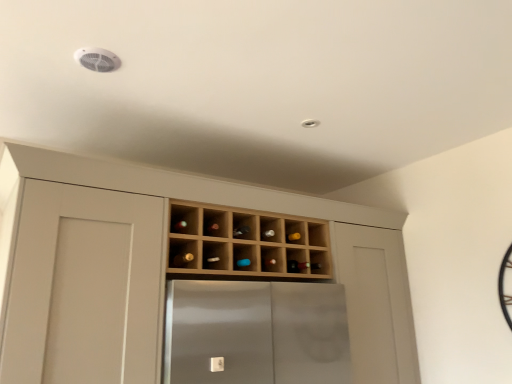
Find the location of a particular element. The image size is (512, 384). matte brown wine bottle at center, the first wine bottle positioned from the left is located at coordinates (182, 259).

The height and width of the screenshot is (384, 512). What do you see at coordinates (182, 259) in the screenshot?
I see `matte brown wine bottle at center, the second wine bottle when ordered from back to front` at bounding box center [182, 259].

The height and width of the screenshot is (384, 512). What are the coordinates of `light wood wine rack at center` in the screenshot? It's located at [x=234, y=206].

I want to click on matte brown wine bottle at center, the second wine bottle when ordered from bottom to top, so click(182, 259).

Which object is wider, translucent glass wine bottle at center, the 1th wine bottle positioned from the right, or matte brown wine bottle at center, the first wine bottle positioned from the left?

With larger width is matte brown wine bottle at center, the first wine bottle positioned from the left.

In terms of height, does translucent glass wine bottle at center, the 2th wine bottle in the front-to-back sequence, look taller or shorter compared to matte brown wine bottle at center, the second wine bottle when ordered from back to front?

translucent glass wine bottle at center, the 2th wine bottle in the front-to-back sequence, is shorter than matte brown wine bottle at center, the second wine bottle when ordered from back to front.

Which is more to the right, translucent glass wine bottle at center, marked as the first wine bottle in a back-to-front arrangement, or matte brown wine bottle at center, placed as the 1th wine bottle when sorted from front to back?

translucent glass wine bottle at center, marked as the first wine bottle in a back-to-front arrangement.

Is translucent glass wine bottle at center, the 1th wine bottle ordered from the bottom, directly adjacent to matte brown wine bottle at center, positioned as the 2th wine bottle in right-to-left order?

No, translucent glass wine bottle at center, the 1th wine bottle ordered from the bottom, is not next to matte brown wine bottle at center, positioned as the 2th wine bottle in right-to-left order.

From a real-world perspective, is wooden wine rack at center below light wood wine rack at center?

No, from a real-world perspective, wooden wine rack at center is not beneath light wood wine rack at center.

Is point (298, 240) closer or farther from the camera than point (205, 178)?

Point (298, 240) is positioned farther from the camera compared to point (205, 178).

How far apart are wooden wine rack at center and light wood wine rack at center?

wooden wine rack at center and light wood wine rack at center are 8.64 inches apart from each other.

Is wooden wine rack at center behind light wood wine rack at center?

That is True.

Considering the relative sizes of light wood wine rack at center and matte brown wine bottle at center, the second wine bottle when ordered from bottom to top, in the image provided, is light wood wine rack at center taller than matte brown wine bottle at center, the second wine bottle when ordered from bottom to top,?

Yes, light wood wine rack at center is taller than matte brown wine bottle at center, the second wine bottle when ordered from bottom to top.

From the image's perspective, relative to matte brown wine bottle at center, the first wine bottle in the top-to-bottom sequence, is light wood wine rack at center above or below?

light wood wine rack at center is situated lower than matte brown wine bottle at center, the first wine bottle in the top-to-bottom sequence, in the image.

Which is in front, light wood wine rack at center or matte brown wine bottle at center, placed as the 1th wine bottle when sorted from front to back?

light wood wine rack at center is more forward.

Which is correct: light wood wine rack at center is inside matte brown wine bottle at center, the second wine bottle when ordered from bottom to top, or outside of it?

The correct answer is: outside.

Image resolution: width=512 pixels, height=384 pixels. In order to click on cupboard below the wooden wine rack at center (from a real-world perspective) in this screenshot , I will do coord(234,206).

Between light wood wine rack at center and wooden wine rack at center, which one appears on the right side from the viewer's perspective?

From the viewer's perspective, wooden wine rack at center appears more on the right side.

Is light wood wine rack at center closer to the viewer compared to wooden wine rack at center?

Yes, it is in front of wooden wine rack at center.

Which is in front, point (106, 183) or point (255, 250)?

Point (106, 183)

Image resolution: width=512 pixels, height=384 pixels. Identify the location of wine bottle that appears on the right of wooden wine rack at center. (301, 266).

Which of these two, translucent glass wine bottle at center, marked as the first wine bottle in a back-to-front arrangement, or wooden wine rack at center, stands taller?

With more height is wooden wine rack at center.

Does translucent glass wine bottle at center, the 2th wine bottle positioned from the top, have a smaller size compared to wooden wine rack at center?

Yes.

Between point (295, 269) and point (247, 219), which one is positioned in front?

The point (247, 219) is more forward.

Does matte brown wine bottle at center, the second wine bottle when ordered from back to front, have a larger size compared to wooden wine rack at center?

Actually, matte brown wine bottle at center, the second wine bottle when ordered from back to front, might be smaller than wooden wine rack at center.

From a real-world perspective, between matte brown wine bottle at center, the second wine bottle when ordered from bottom to top, and wooden wine rack at center, who is vertically lower?

matte brown wine bottle at center, the second wine bottle when ordered from bottom to top, is physically lower.

Is matte brown wine bottle at center, the first wine bottle in the top-to-bottom sequence, wider than wooden wine rack at center?

Incorrect, the width of matte brown wine bottle at center, the first wine bottle in the top-to-bottom sequence, does not surpass that of wooden wine rack at center.

Who is bigger, matte brown wine bottle at center, the second wine bottle when ordered from bottom to top, or translucent glass wine bottle at center, the 1th wine bottle ordered from the bottom?

matte brown wine bottle at center, the second wine bottle when ordered from bottom to top, is bigger.

Based on the photo, does matte brown wine bottle at center, placed as the 1th wine bottle when sorted from front to back, have a lesser height compared to translucent glass wine bottle at center, the 1th wine bottle positioned from the right?

No.

Is matte brown wine bottle at center, positioned as the 2th wine bottle in right-to-left order, facing away from translucent glass wine bottle at center, the 1th wine bottle ordered from the bottom?

No, matte brown wine bottle at center, positioned as the 2th wine bottle in right-to-left order, is not facing away from translucent glass wine bottle at center, the 1th wine bottle ordered from the bottom.

Considering the relative sizes of matte brown wine bottle at center, the second wine bottle when ordered from bottom to top, and translucent glass wine bottle at center, arranged as the 2th wine bottle when viewed from the left, in the image provided, is matte brown wine bottle at center, the second wine bottle when ordered from bottom to top, wider than translucent glass wine bottle at center, arranged as the 2th wine bottle when viewed from the left,?

Correct, the width of matte brown wine bottle at center, the second wine bottle when ordered from bottom to top, exceeds that of translucent glass wine bottle at center, arranged as the 2th wine bottle when viewed from the left.

The image size is (512, 384). I want to click on wine bottle below the matte brown wine bottle at center, the first wine bottle in the top-to-bottom sequence (from the image's perspective), so click(x=301, y=266).

Find the location of `cupboard on the left of the wooden wine rack at center`. cupboard on the left of the wooden wine rack at center is located at coordinates (234, 206).

Considering their positions, is wooden wine rack at center positioned further to light wood wine rack at center than translucent glass wine bottle at center, the 2th wine bottle positioned from the top?

translucent glass wine bottle at center, the 2th wine bottle positioned from the top, is positioned further to the anchor light wood wine rack at center.

Based on the photo, based on their spatial positions, is wooden wine rack at center or matte brown wine bottle at center, the second wine bottle when ordered from bottom to top, further from light wood wine rack at center?

matte brown wine bottle at center, the second wine bottle when ordered from bottom to top, lies further to light wood wine rack at center than the other object.

Looking at the image, which one is located further to translucent glass wine bottle at center, the 1th wine bottle ordered from the bottom, wooden wine rack at center or light wood wine rack at center?

light wood wine rack at center is further to translucent glass wine bottle at center, the 1th wine bottle ordered from the bottom.

From the image, which object appears to be nearer to wooden wine rack at center, translucent glass wine bottle at center, arranged as the 2th wine bottle when viewed from the left, or matte brown wine bottle at center, positioned as the 2th wine bottle in right-to-left order?

translucent glass wine bottle at center, arranged as the 2th wine bottle when viewed from the left, lies closer to wooden wine rack at center than the other object.

Estimate the real-world distances between objects in this image. Which object is further from wooden wine rack at center, light wood wine rack at center or translucent glass wine bottle at center, the 1th wine bottle ordered from the bottom?

translucent glass wine bottle at center, the 1th wine bottle ordered from the bottom.

From the image, which object appears to be farther from matte brown wine bottle at center, the second wine bottle when ordered from bottom to top, light wood wine rack at center or wooden wine rack at center?

Based on the image, light wood wine rack at center appears to be further to matte brown wine bottle at center, the second wine bottle when ordered from bottom to top.

Based on their spatial positions, is light wood wine rack at center or wooden wine rack at center closer to translucent glass wine bottle at center, marked as the first wine bottle in a back-to-front arrangement?

The object closer to translucent glass wine bottle at center, marked as the first wine bottle in a back-to-front arrangement, is wooden wine rack at center.

Looking at the image, which one is located further to wooden wine rack at center, light wood wine rack at center or matte brown wine bottle at center, the first wine bottle positioned from the left?

matte brown wine bottle at center, the first wine bottle positioned from the left, is further to wooden wine rack at center.

At what (x,y) coordinates should I click in order to perform the action: click on shelf between light wood wine rack at center and matte brown wine bottle at center, the first wine bottle positioned from the left, along the z-axis. Please return your answer as a coordinate pair (x, y). This screenshot has width=512, height=384. Looking at the image, I should click on (246, 242).

You are a GUI agent. You are given a task and a screenshot of the screen. Output one action in this format:
    pyautogui.click(x=<x>, y=<y>)
    Task: Click on the wine bottle between light wood wine rack at center and translucent glass wine bottle at center, marked as the first wine bottle in a back-to-front arrangement, from front to back
    The width and height of the screenshot is (512, 384).
    Given the screenshot: What is the action you would take?
    pyautogui.click(x=182, y=259)

Where is `shelf between light wood wine rack at center and translucent glass wine bottle at center, the 2th wine bottle in the front-to-back sequence, in the front-back direction`? Image resolution: width=512 pixels, height=384 pixels. shelf between light wood wine rack at center and translucent glass wine bottle at center, the 2th wine bottle in the front-to-back sequence, in the front-back direction is located at coordinates (246, 242).

Locate an element on the screen. shelf located between matte brown wine bottle at center, placed as the 1th wine bottle when sorted from front to back, and translucent glass wine bottle at center, the 2th wine bottle in the front-to-back sequence, in the left-right direction is located at coordinates (246, 242).